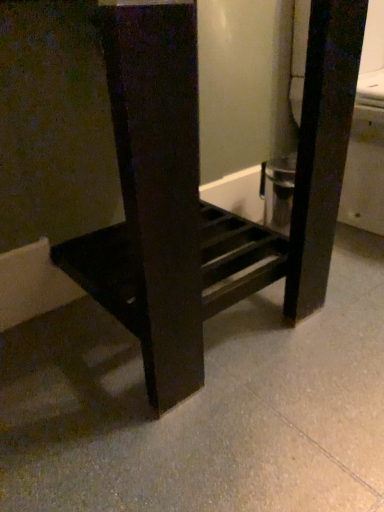
The height and width of the screenshot is (512, 384). In order to click on spots to the right of matte black shelf at lower center in this screenshot , I will do `click(344, 312)`.